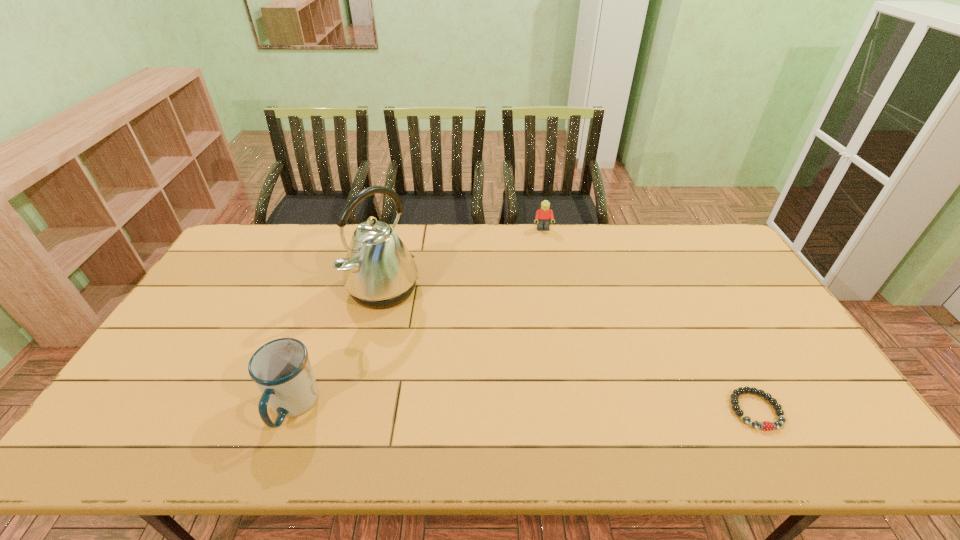
Identify the location of blank region between the mug and the shortest object. (524, 408).

Image resolution: width=960 pixels, height=540 pixels. In order to click on free space between the second object from right to left and the third shortest object in this screenshot , I will do `click(418, 318)`.

Locate an element on the screen. This screenshot has width=960, height=540. free space between the Lego and the third shortest object is located at coordinates pyautogui.click(x=418, y=318).

Where is `vacant area between the second farthest object and the bracelet`? Image resolution: width=960 pixels, height=540 pixels. vacant area between the second farthest object and the bracelet is located at coordinates (569, 350).

The height and width of the screenshot is (540, 960). What are the coordinates of `free space between the Lego and the rightmost object` in the screenshot? It's located at (649, 320).

Choose which object is the third nearest neighbor to the third nearest object. Please provide its 2D coordinates. Your answer should be formatted as a tuple, i.e. [(x, y)], where the tuple contains the x and y coordinates of a point satisfying the conditions above.

[(765, 425)]

Select which object is the third closest to the bracelet. Please provide its 2D coordinates. Your answer should be formatted as a tuple, i.e. [(x, y)], where the tuple contains the x and y coordinates of a point satisfying the conditions above.

[(281, 368)]

Where is `vacant space that satisfies the following two spatial constraints: 1. on the back side of the kettle; 2. on the left side of the farthest object`? vacant space that satisfies the following two spatial constraints: 1. on the back side of the kettle; 2. on the left side of the farthest object is located at coordinates (398, 230).

At what (x,y) coordinates should I click in order to perform the action: click on blank area in the image that satisfies the following two spatial constraints: 1. on the front side of the shortest object; 2. on the left side of the farthest object. Please return your answer as a coordinate pair (x, y). This screenshot has width=960, height=540. Looking at the image, I should click on pos(577,410).